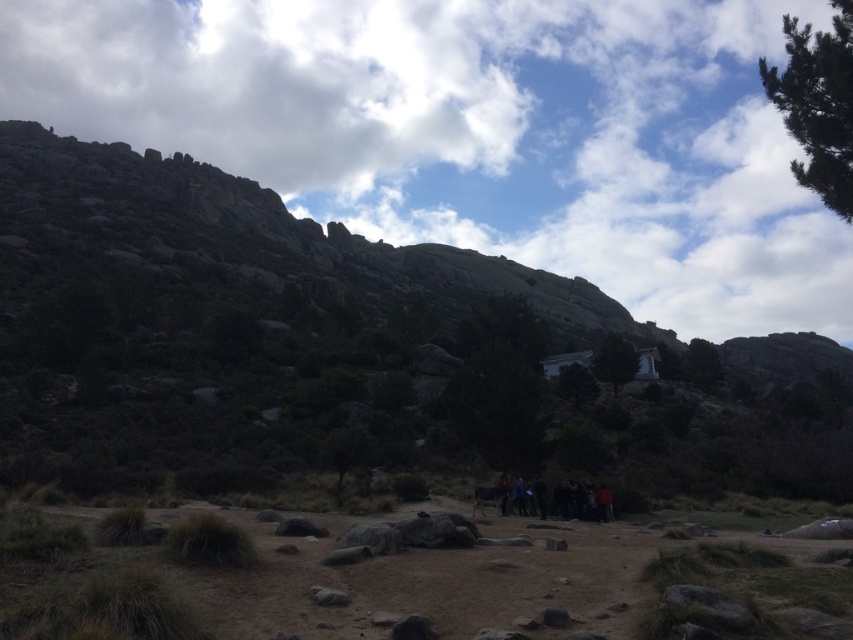
You are a photographer standing at the base of the mountain and want to capture a photo of the white fluffy cloud at upper center. If your camera has a focal length of 50mm, what is the approximate distance in meters you need to focus on to ensure the cloud is sharp?

The white fluffy cloud at upper center is 217.19 meters from camera, so you should focus your camera at approximately 217.19 meters to ensure the cloud is sharp.

You are a hiker who wants to take a photo of the dark clothing group at center and the white fluffy cloud at upper center. Which object in the scene is bigger?

The white fluffy cloud at upper center is larger in size than the dark clothing group at center, so the white fluffy cloud at upper center is bigger.